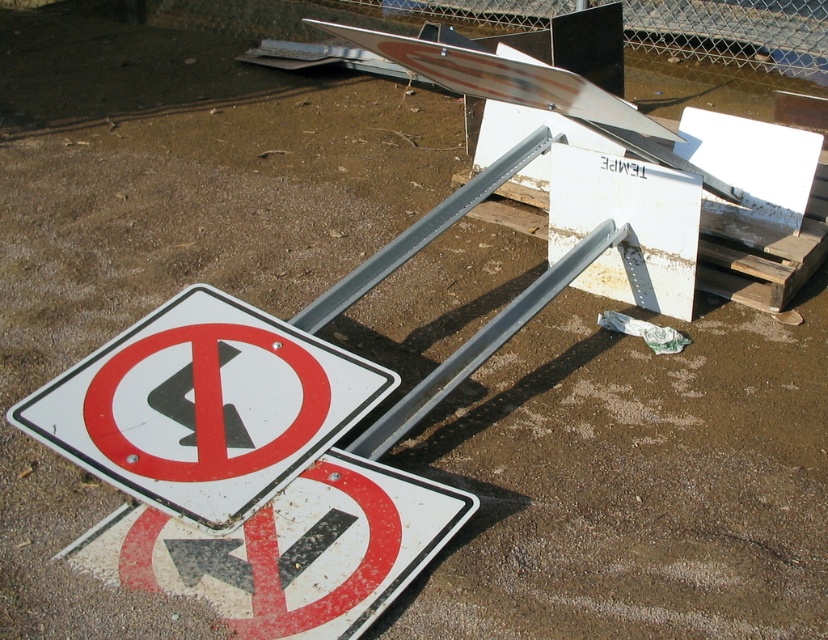
You are a road worker inspecting the area and need to place a new sign between the white matte traffic sign at lower left and the white plastic traffic sign at lower left. Can you fit the new sign there?

The white matte traffic sign at lower left is to the left of white plastic traffic sign at lower left, so there is space between them to place the new sign.

You are a delivery driver who needs to place both the white matte traffic sign at lower left and the white plastic traffic sign at lower left into a storage box. The box can only hold items up to the size of the smaller sign. Which sign should you avoid placing in the box?

You should avoid placing the white matte traffic sign at lower left in the box because it is bigger than the white plastic traffic sign at lower left, exceeding the box size limit.